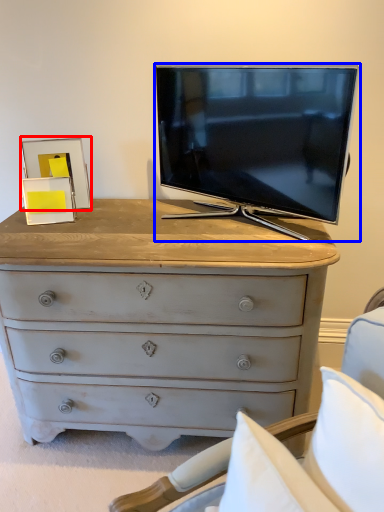
Question: Among these objects, which one is farthest to the camera, picture frame (highlighted by a red box) or television (highlighted by a blue box)?

Choices:
 (A) picture frame
 (B) television

Answer: (A)